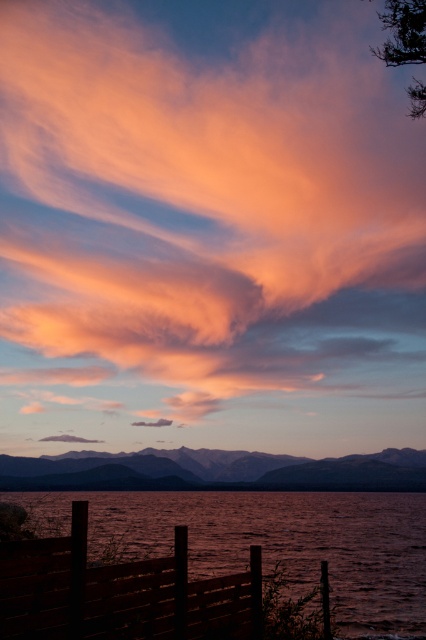
You are a photographer trying to capture the sunset. You have two points marked on your camera screen at coordinates point (262, 113) and point (219, 497). Which point is closer to your camera lens?

Point (262, 113) is further to the viewer than point (219, 497), so the point closer to the camera lens is point (219, 497).

You are an artist trying to paint the sunset scene. You want to place the dull brown water at lower left and the matte orange cloud at upper center in your painting. According to the scene, which object should you paint first to ensure proper layering?

The matte orange cloud at upper center should be painted first because the dull brown water at lower left is behind it, meaning the cloud needs to be layered over the water.

You are an artist planning to paint the sunset scene. You have two colors, one for the matte orange cloud at upper center and one for the dull brown water at lower left. Which object requires a larger amount of paint?

The matte orange cloud at upper center requires a larger amount of paint because it is bigger than the dull brown water at lower left.